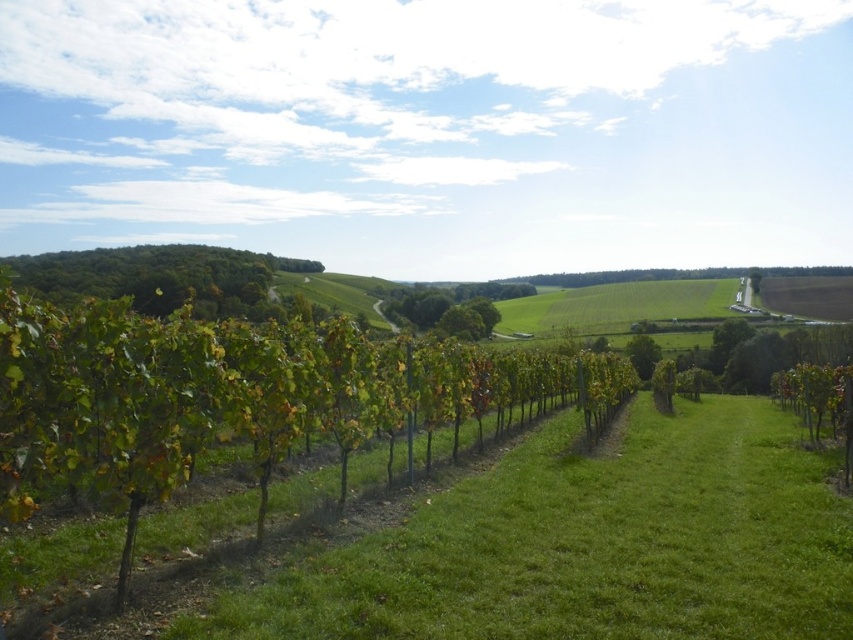
Question: Which object is positioned closest to the green leafy tree at center?

Choices:
 (A) green leafy tree at upper right
 (B) green leafy vines at center
 (C) green leafy tree at upper left

Answer: (B)

Question: Which object is positioned closest to the green leafy vines at center?

Choices:
 (A) green leafy tree at upper right
 (B) green leafy tree at center

Answer: (B)

Question: Is green leafy tree at center to the left of green leafy tree at upper right from the viewer's perspective?

Choices:
 (A) no
 (B) yes

Answer: (B)

Question: Is green leafy tree at upper left thinner than green leafy tree at upper right?

Choices:
 (A) no
 (B) yes

Answer: (A)

Question: Can you confirm if green leafy tree at center is smaller than green leafy tree at upper right?

Choices:
 (A) no
 (B) yes

Answer: (B)

Question: Among these points, which one is nearest to the camera?

Choices:
 (A) (646, 358)
 (B) (97, 364)
 (C) (755, 268)

Answer: (B)